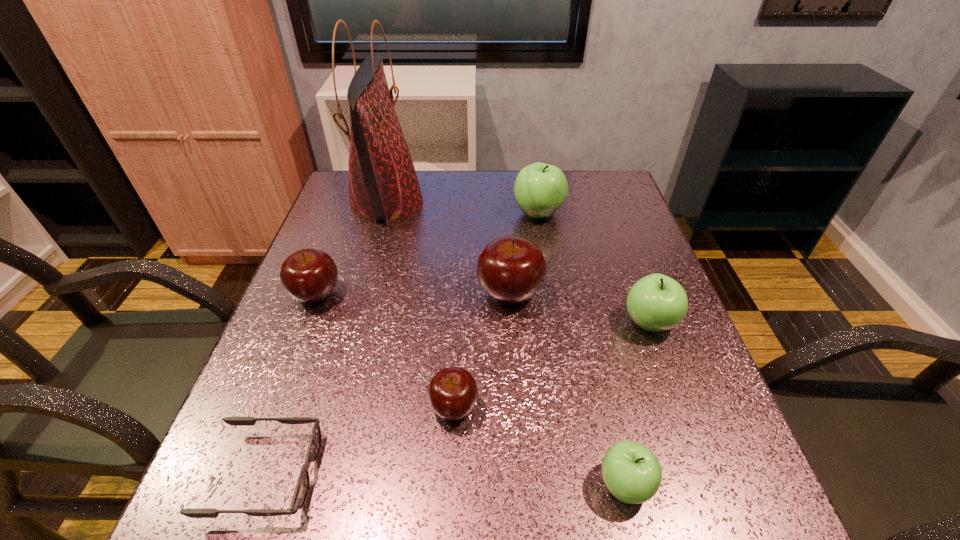
At what (x,y) coordinates should I click in order to perform the action: click on handbag. Please return your answer as a coordinate pair (x, y). Looking at the image, I should click on 383,185.

The height and width of the screenshot is (540, 960). Identify the location of the farthest apple. (540, 189).

Locate an element on the screen. the biggest green apple is located at coordinates click(540, 189).

You are a GUI agent. You are given a task and a screenshot of the screen. Output one action in this format:
    pyautogui.click(x=<x>, y=<y>)
    Task: Click on the biggest red apple
    The image size is (960, 540).
    Given the screenshot: What is the action you would take?
    pyautogui.click(x=510, y=269)

Find the location of a particular element. This screenshot has height=540, width=960. the leftmost apple is located at coordinates (309, 275).

Locate an element on the screen. the leftmost red apple is located at coordinates (309, 275).

Locate an element on the screen. This screenshot has height=540, width=960. the rightmost green apple is located at coordinates (656, 302).

Image resolution: width=960 pixels, height=540 pixels. I want to click on the second smallest green apple, so pyautogui.click(x=656, y=302).

The width and height of the screenshot is (960, 540). In order to click on the nearest red apple in this screenshot , I will do `click(452, 393)`.

The image size is (960, 540). What are the coordinates of `the smallest red apple` in the screenshot? It's located at (452, 393).